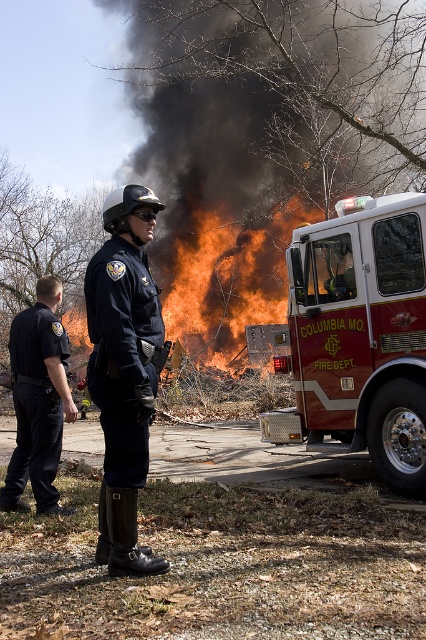
Question: Can you confirm if red glossy fire truck at right is positioned below black uniform pants at left?

Choices:
 (A) yes
 (B) no

Answer: (B)

Question: Can you confirm if black smoke at upper center is positioned to the left of matte black uniform at center?

Choices:
 (A) yes
 (B) no

Answer: (A)

Question: Which object appears closest to the camera in this image?

Choices:
 (A) red glossy fire truck at right
 (B) black uniform pants at left
 (C) black smoke at upper center

Answer: (B)

Question: Is flame orange fire at center positioned before black uniform pants at left?

Choices:
 (A) yes
 (B) no

Answer: (B)

Question: Which of the following is the farthest from the observer?

Choices:
 (A) red glossy fire truck at right
 (B) matte black uniform at center
 (C) black smoke at upper center

Answer: (C)

Question: Considering the real-world distances, which object is closest to the red glossy fire truck at right?

Choices:
 (A) matte black uniform at center
 (B) black smoke at upper center
 (C) black uniform pants at left
 (D) flame orange fire at center

Answer: (C)